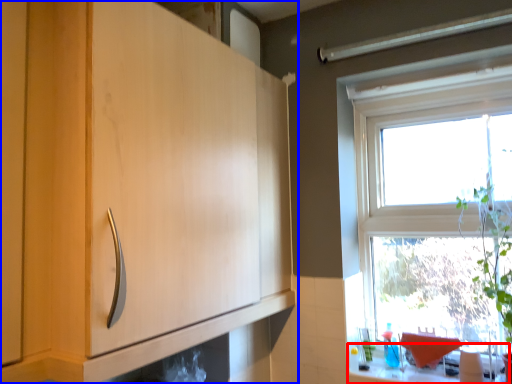
Question: Which of the following is the closest to the observer, counter top (highlighted by a red box) or cabinetry (highlighted by a blue box)?

Choices:
 (A) counter top
 (B) cabinetry

Answer: (B)